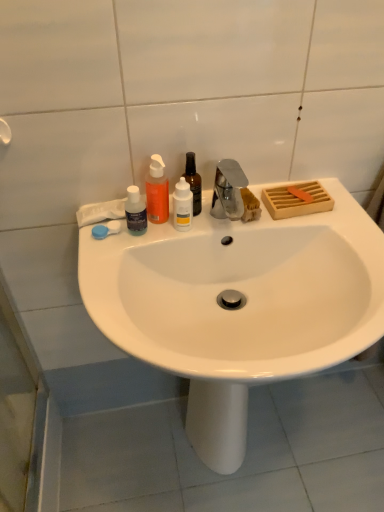
Find the location of `vacant space situated on the left part of white matte bottle at center, which is counted as the second bottle, starting from the right`. vacant space situated on the left part of white matte bottle at center, which is counted as the second bottle, starting from the right is located at coordinates (119, 247).